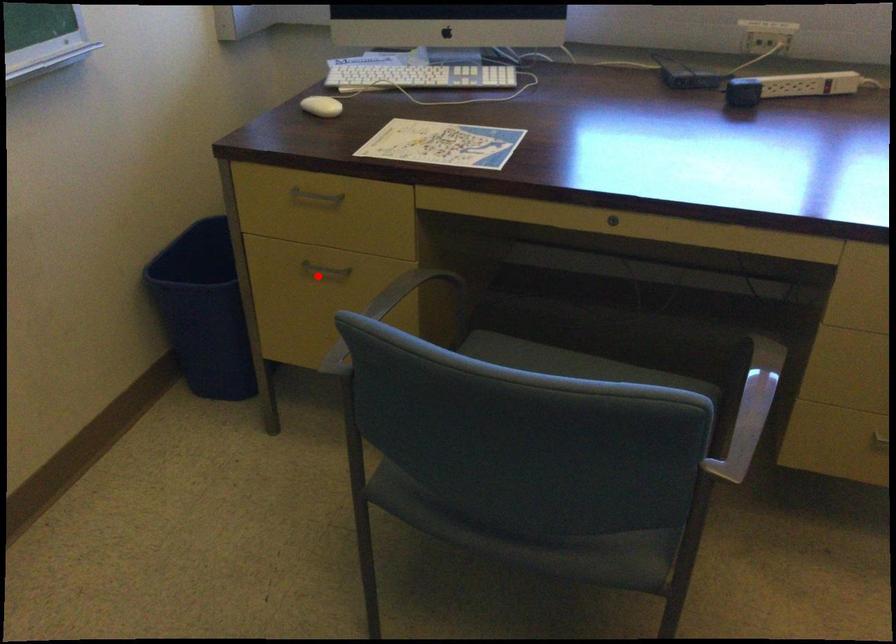
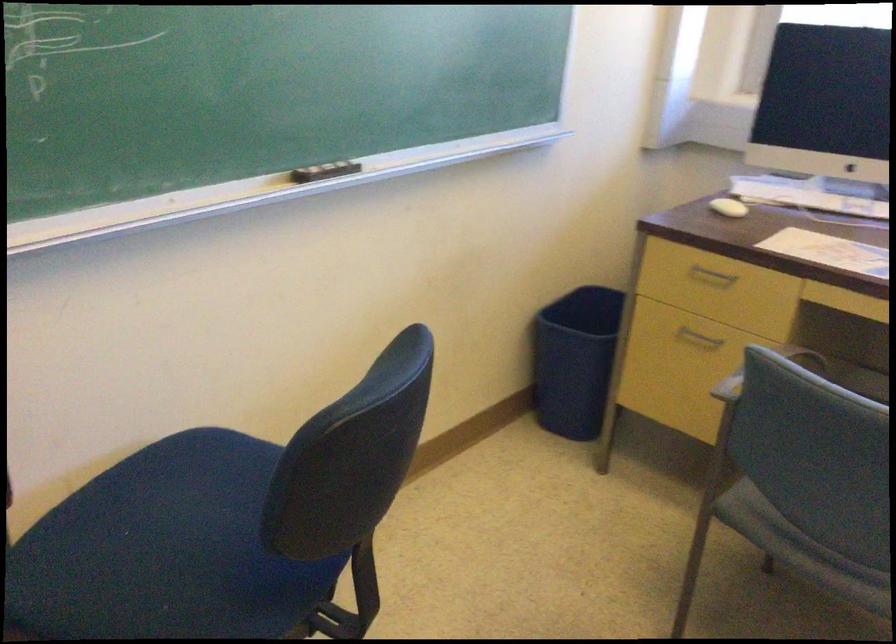
Question: I am providing you with two images of the same scene from different viewpoints. Image1 has a red point marked. In image2, the corresponding 3D location appears at what relative position? Reply with the corresponding letter.

Choices:
 (A) Closer
 (B) Farther

Answer: (B)